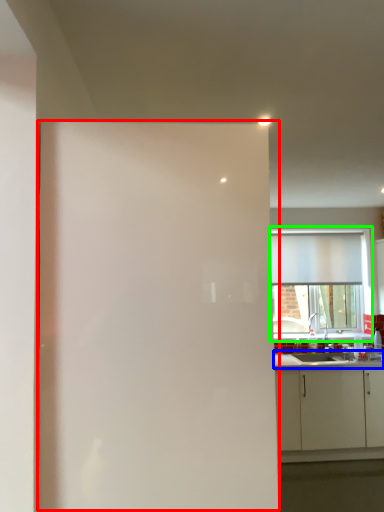
Question: Considering the real-world distances, which object is farthest from screen door (highlighted by a red box)? countertop (highlighted by a blue box) or window (highlighted by a green box)?

Choices:
 (A) countertop
 (B) window

Answer: (B)